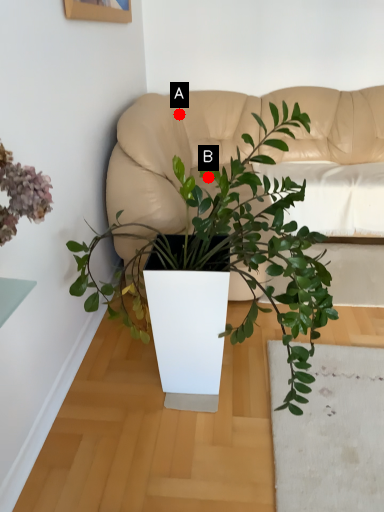
Question: Two points are circled on the image, labeled by A and B beside each circle. Which point is further to the camera?

Choices:
 (A) A is further
 (B) B is further

Answer: (A)